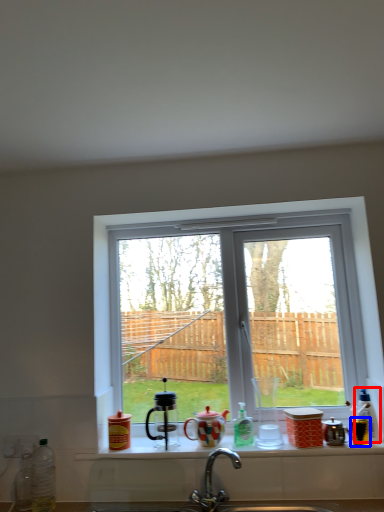
Question: Which of the following is the farthest to the observer, bottle (highlighted by a red box) or appliance (highlighted by a blue box)?

Choices:
 (A) bottle
 (B) appliance

Answer: (A)